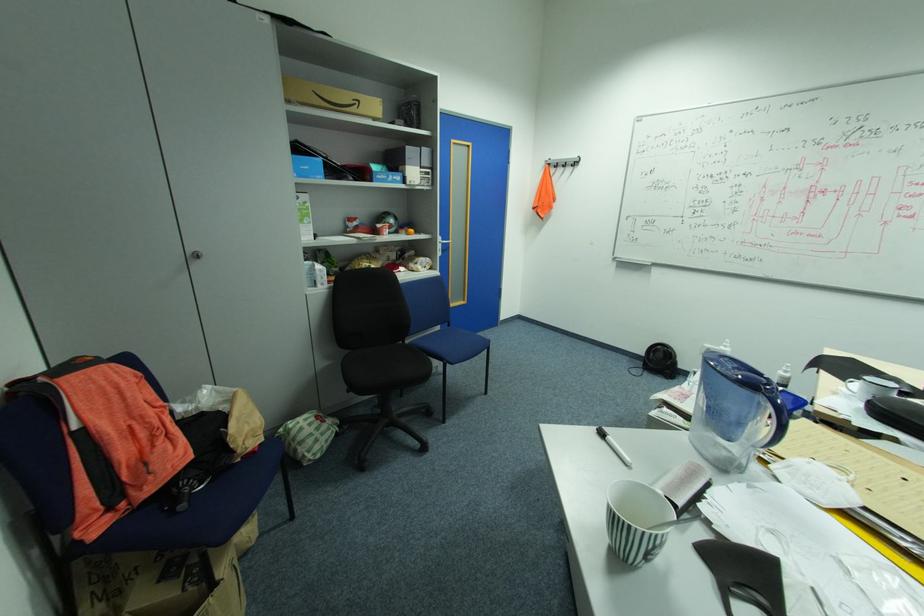
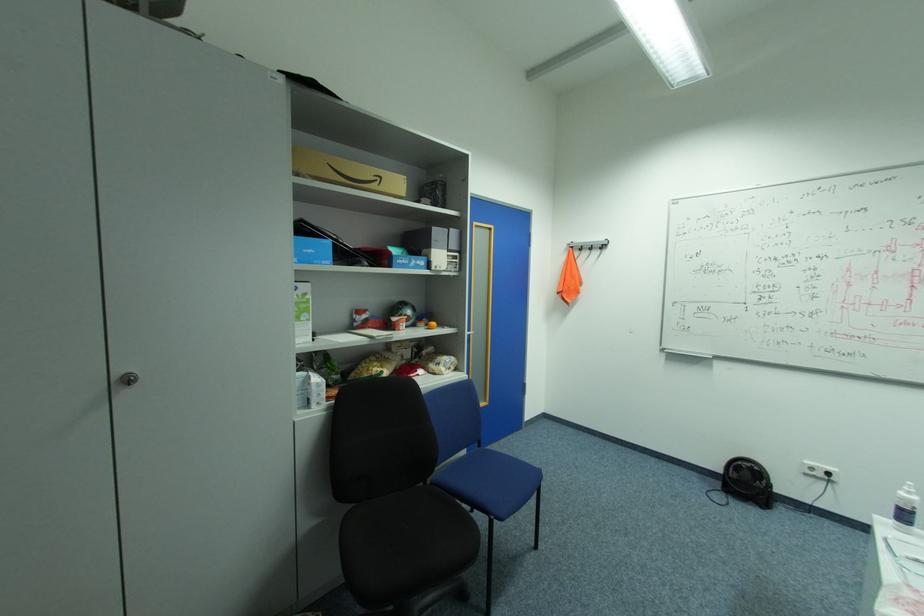
Where in the second image is the point corresponding to pixel 203 256 from the first image?

(137, 379)